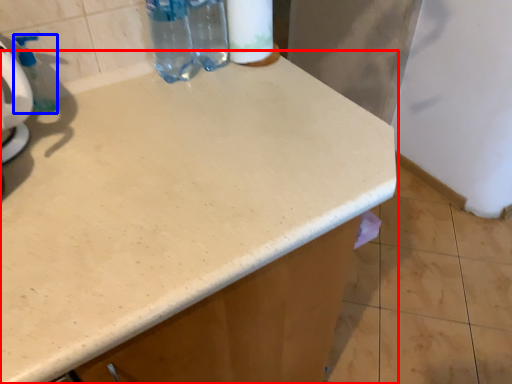
Question: Which object is further to the camera taking this photo, countertop (highlighted by a red box) or soap dispenser (highlighted by a blue box)?

Choices:
 (A) countertop
 (B) soap dispenser

Answer: (B)